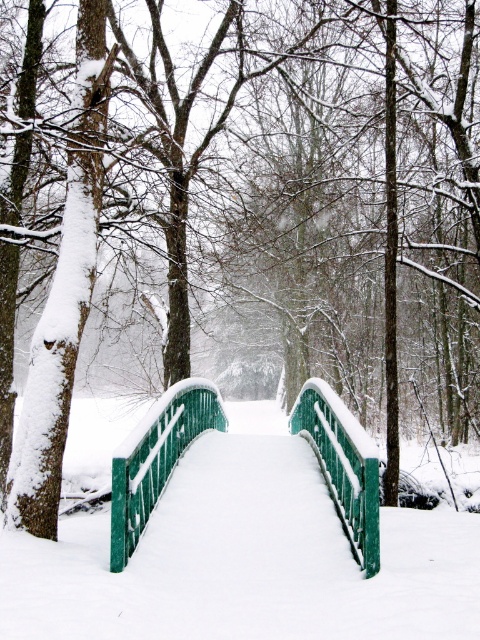
Which of these two, green painted wood bridge at center or green painted metal railing at center, stands shorter?

Standing shorter between the two is green painted metal railing at center.

Who is higher up, green painted wood bridge at center or green painted metal railing at center?

green painted metal railing at center is higher up.

Is point (399, 557) positioned behind point (144, 417)?

No, (399, 557) is in front of (144, 417).

I want to click on green painted wood bridge at center, so click(x=244, y=557).

Is green painted wood bridge at center taller than green painted wood rail at center?

Yes.

Is green painted wood bridge at center to the left of green painted wood rail at center from the viewer's perspective?

Yes, green painted wood bridge at center is to the left of green painted wood rail at center.

The width and height of the screenshot is (480, 640). What do you see at coordinates (244, 557) in the screenshot? I see `green painted wood bridge at center` at bounding box center [244, 557].

The image size is (480, 640). Find the location of `green painted wood bridge at center`. green painted wood bridge at center is located at coordinates (244, 557).

Can you confirm if green matte bridge at center is bigger than green painted metal railing at center?

Indeed, green matte bridge at center has a larger size compared to green painted metal railing at center.

What do you see at coordinates (156, 458) in the screenshot? The width and height of the screenshot is (480, 640). I see `green matte bridge at center` at bounding box center [156, 458].

Locate an element on the screen. The width and height of the screenshot is (480, 640). green matte bridge at center is located at coordinates (x=156, y=458).